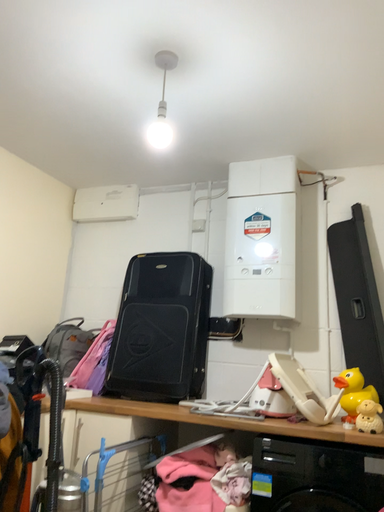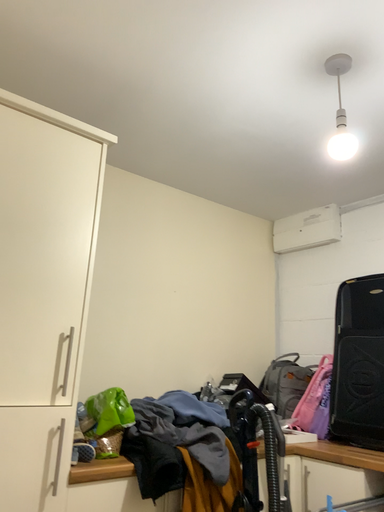
Question: Which way did the camera rotate in the video?

Choices:
 (A) rotated right
 (B) rotated left

Answer: (B)